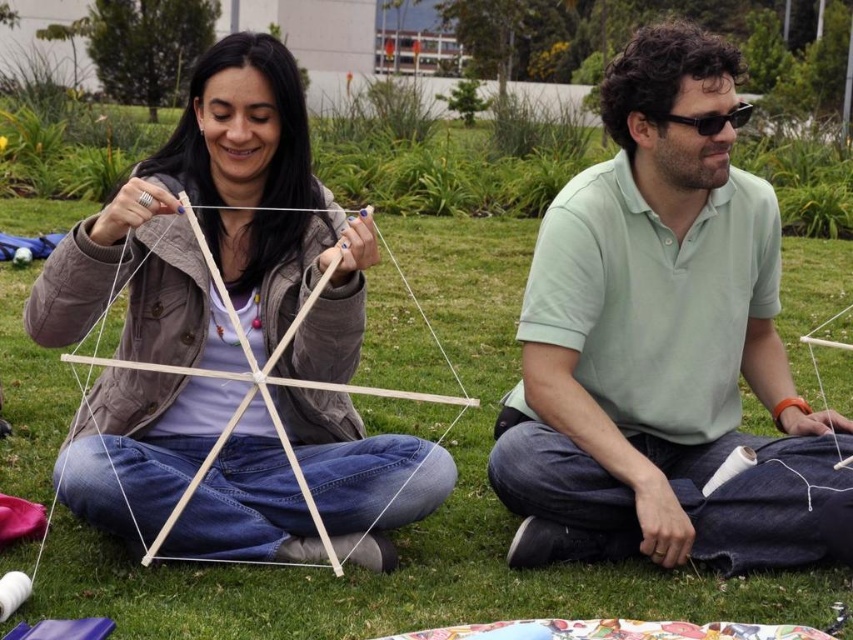
Question: Is green grass at center wider than white matte string at center?

Choices:
 (A) no
 (B) yes

Answer: (A)

Question: Does white matte string at center appear on the right side of black plastic goggles at upper right?

Choices:
 (A) no
 (B) yes

Answer: (A)

Question: Estimate the real-world distances between objects in this image. Which object is farther from the white matte string at center?

Choices:
 (A) black plastic goggles at upper right
 (B) light green cotton shirt at center
 (C) green grass at center

Answer: (A)

Question: Which object appears closest to the camera in this image?

Choices:
 (A) light green cotton shirt at center
 (B) green grass at center

Answer: (B)

Question: Which object is farther from the camera taking this photo?

Choices:
 (A) green grass at center
 (B) white matte string at center
 (C) black plastic goggles at upper right

Answer: (C)

Question: In this image, where is white matte string at center located relative to black plastic goggles at upper right?

Choices:
 (A) left
 (B) right

Answer: (A)